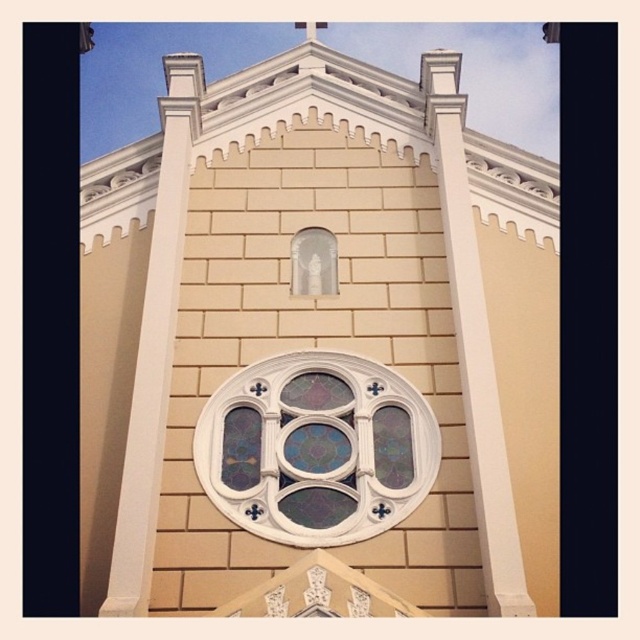
Is the position of stained glass window at center more distant than that of translucent glass statue at center?

No.

From the picture: Can you confirm if stained glass window at center is positioned below translucent glass statue at center?

Yes.

The image size is (640, 640). I want to click on stained glass window at center, so click(x=316, y=449).

I want to click on stained glass window at center, so click(316, 449).

Between beige stone church at center and translucent glass statue at center, which one is positioned lower?

translucent glass statue at center is below.

Image resolution: width=640 pixels, height=640 pixels. Find the location of `beige stone church at center`. beige stone church at center is located at coordinates (317, 346).

What do you see at coordinates (314, 262) in the screenshot? Image resolution: width=640 pixels, height=640 pixels. I see `translucent glass statue at center` at bounding box center [314, 262].

Which is in front, point (307, 280) or point (298, 20)?

Point (307, 280)

Find the location of a particular element. translucent glass statue at center is located at coordinates (314, 262).